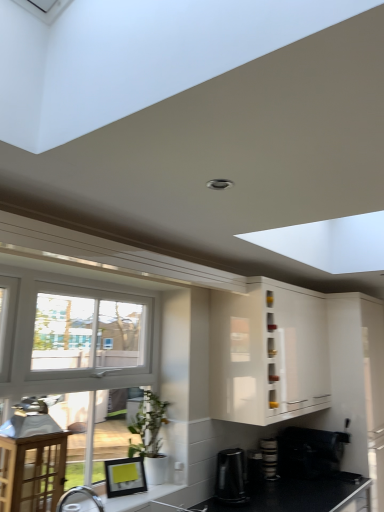
Looking at this image, what is the approximate height of black matte countertop at lower right?

11.59 inches.

This screenshot has height=512, width=384. Describe the element at coordinates (230, 477) in the screenshot. I see `black plastic coffee maker at lower center, which is the 1th appliance from left to right` at that location.

This screenshot has height=512, width=384. Identify the location of black plastic coffee maker at lower center, which is the 1th appliance from left to right. (230, 477).

Locate an element on the screen. The image size is (384, 512). stacked plates at lower right, which is the 3th appliance from left to right is located at coordinates (269, 457).

Where is `black matte coffee maker at lower right, the fourth appliance positioned from the left`? The image size is (384, 512). black matte coffee maker at lower right, the fourth appliance positioned from the left is located at coordinates (310, 452).

I want to click on black plastic coffee maker at lower center, the 2th appliance positioned from the left, so click(254, 466).

Considering the relative sizes of wooden table at left and white glossy countertop at lower left in the image provided, is wooden table at left thinner than white glossy countertop at lower left?

Indeed, wooden table at left has a lesser width compared to white glossy countertop at lower left.

Between point (17, 450) and point (169, 499), which one is positioned behind?

Point (169, 499)

In the scene shown: Which is more to the right, wooden table at left or white glossy countertop at lower left?

From the viewer's perspective, white glossy countertop at lower left appears more on the right side.

From their relative heights in the image, would you say wooden table at left is taller or shorter than white glossy countertop at lower left?

wooden table at left is taller than white glossy countertop at lower left.

Which of these two, white glossy countertop at lower left or stacked plates at lower right, which appears as the 2th appliance when viewed from the right, stands shorter?

white glossy countertop at lower left.

Is white glossy countertop at lower left wider or thinner than stacked plates at lower right, which appears as the 2th appliance when viewed from the right?

In the image, white glossy countertop at lower left appears to be wider than stacked plates at lower right, which appears as the 2th appliance when viewed from the right.

Between white glossy countertop at lower left and stacked plates at lower right, which is the 3th appliance from left to right, which one appears on the left side from the viewer's perspective?

Positioned to the left is white glossy countertop at lower left.

Does white glossy countertop at lower left touch stacked plates at lower right, which is the 3th appliance from left to right?

No, white glossy countertop at lower left is not beside stacked plates at lower right, which is the 3th appliance from left to right.

From the image's perspective, is white matte pot at lower center positioned above or below black matte countertop at lower right?

Clearly, from the image's perspective, white matte pot at lower center is above black matte countertop at lower right.

You are a GUI agent. You are given a task and a screenshot of the screen. Output one action in this format:
    pyautogui.click(x=<x>, y=<y>)
    Task: Click on the houseplant lying on the left of black matte countertop at lower right
    This screenshot has width=384, height=512.
    Given the screenshot: What is the action you would take?
    pyautogui.click(x=150, y=436)

In the scene shown: Is white matte pot at lower center facing towards black matte countertop at lower right?

No, white matte pot at lower center is not turned towards black matte countertop at lower right.

Considering the positions of objects white matte pot at lower center and black matte countertop at lower right in the image provided, who is more to the left, white matte pot at lower center or black matte countertop at lower right?

Positioned to the left is white matte pot at lower center.

From a real-world perspective, which is physically above, black matte countertop at lower right or wooden table at left?

In real-world perspective, wooden table at left is above.

Considering the sizes of objects black matte countertop at lower right and wooden table at left in the image provided, who is smaller, black matte countertop at lower right or wooden table at left?

With smaller size is wooden table at left.

Does black matte countertop at lower right come behind wooden table at left?

Yes, the depth of black matte countertop at lower right is greater than that of wooden table at left.

From the image's perspective, is black matte countertop at lower right over wooden table at left?

No.

Considering the positions of objects black plastic coffee maker at lower center, the 2th appliance positioned from the left, and white matte pot at lower center in the image provided, who is behind, black plastic coffee maker at lower center, the 2th appliance positioned from the left, or white matte pot at lower center?

black plastic coffee maker at lower center, the 2th appliance positioned from the left, is behind.

Between black plastic coffee maker at lower center, acting as the 3th appliance starting from the right, and white matte pot at lower center, which one appears on the left side from the viewer's perspective?

Positioned to the left is white matte pot at lower center.

Which is nearer, (257,463) or (165,472)?

Point (257,463).

Considering the sizes of objects black plastic coffee maker at lower center, acting as the 3th appliance starting from the right, and white matte pot at lower center in the image provided, who is taller, black plastic coffee maker at lower center, acting as the 3th appliance starting from the right, or white matte pot at lower center?

With more height is white matte pot at lower center.

Are stacked plates at lower right, which is the 3th appliance from left to right, and black plastic coffee maker at lower center, acting as the 3th appliance starting from the right, far apart?

No, there isn't a large distance between stacked plates at lower right, which is the 3th appliance from left to right, and black plastic coffee maker at lower center, acting as the 3th appliance starting from the right.

Does stacked plates at lower right, which appears as the 2th appliance when viewed from the right, appear on the left side of black plastic coffee maker at lower center, acting as the 3th appliance starting from the right?

Incorrect, stacked plates at lower right, which appears as the 2th appliance when viewed from the right, is not on the left side of black plastic coffee maker at lower center, acting as the 3th appliance starting from the right.

Which object is wider, stacked plates at lower right, which appears as the 2th appliance when viewed from the right, or black plastic coffee maker at lower center, acting as the 3th appliance starting from the right?

black plastic coffee maker at lower center, acting as the 3th appliance starting from the right.

Identify the location of the 1st appliance counting from the left of the stacked plates at lower right, which appears as the 2th appliance when viewed from the right. This screenshot has height=512, width=384. (254, 466).

Would you say white glossy countertop at lower left is to the left or to the right of white matte pot at lower center in the picture?

white glossy countertop at lower left is positioned on white matte pot at lower center's left side.

At what (x,y) coordinates should I click in order to perform the action: click on houseplant located above the white glossy countertop at lower left (from the image's perspective). Please return your answer as a coordinate pair (x, y). The height and width of the screenshot is (512, 384). Looking at the image, I should click on (150, 436).

Considering the relative sizes of white glossy countertop at lower left and white matte pot at lower center in the image provided, is white glossy countertop at lower left shorter than white matte pot at lower center?

Yes, white glossy countertop at lower left is shorter than white matte pot at lower center.

This screenshot has width=384, height=512. Identify the location of table that is above the white glossy countertop at lower left (from a real-world perspective). (32, 472).

The width and height of the screenshot is (384, 512). Identify the location of the 4th appliance behind the white glossy countertop at lower left, starting your count from the anchor. (269, 457).

Which object lies further to the anchor point wooden table at left, stacked plates at lower right, which is the 3th appliance from left to right, or white glossy cabinet at upper center?

stacked plates at lower right, which is the 3th appliance from left to right, is further to wooden table at left.

Looking at the image, which one is located further to black plastic coffee maker at lower center, the 2th appliance positioned from the left, black plastic coffee maker at lower center, which is the 1th appliance from left to right, or stacked plates at lower right, which appears as the 2th appliance when viewed from the right?

black plastic coffee maker at lower center, which is the 1th appliance from left to right, lies further to black plastic coffee maker at lower center, the 2th appliance positioned from the left, than the other object.

Estimate the real-world distances between objects in this image. Which object is further from white glossy cabinet at upper center, black matte coffee maker at lower right, arranged as the 1th appliance when viewed from the right, or black matte countertop at lower right?

black matte countertop at lower right.

Which object lies further to the anchor point white glossy cabinet at upper center, black matte coffee maker at lower right, arranged as the 1th appliance when viewed from the right, or black plastic coffee maker at lower center, acting as the 4th appliance starting from the right?

The object further to white glossy cabinet at upper center is black matte coffee maker at lower right, arranged as the 1th appliance when viewed from the right.

Based on their spatial positions, is white glossy cabinet at upper center or black plastic coffee maker at lower center, acting as the 4th appliance starting from the right, closer to white matte pot at lower center?

black plastic coffee maker at lower center, acting as the 4th appliance starting from the right.

In the scene shown: Considering their positions, is black plastic coffee maker at lower center, which is the 1th appliance from left to right, positioned closer to stacked plates at lower right, which appears as the 2th appliance when viewed from the right, than white glossy countertop at lower left?

black plastic coffee maker at lower center, which is the 1th appliance from left to right.

Looking at this image, based on their spatial positions, is black matte countertop at lower right or black plastic coffee maker at lower center, the 2th appliance positioned from the left, further from white glossy countertop at lower left?

The object further to white glossy countertop at lower left is black plastic coffee maker at lower center, the 2th appliance positioned from the left.

Considering their positions, is stacked plates at lower right, which appears as the 2th appliance when viewed from the right, positioned closer to black matte coffee maker at lower right, the fourth appliance positioned from the left, than black plastic coffee maker at lower center, the 2th appliance positioned from the left?

Based on the image, stacked plates at lower right, which appears as the 2th appliance when viewed from the right, appears to be nearer to black matte coffee maker at lower right, the fourth appliance positioned from the left.

Identify the location of houseplant between white glossy countertop at lower left and black matte countertop at lower right in the horizontal direction. (150, 436).

Find the location of a particular element. houseplant between wooden table at left and black plastic coffee maker at lower center, acting as the 4th appliance starting from the right, from left to right is located at coordinates (150, 436).

Find the location of a particular element. cabinetry located between white glossy countertop at lower left and black matte countertop at lower right in the left-right direction is located at coordinates click(x=268, y=354).

This screenshot has width=384, height=512. What are the coordinates of `countertop located between black plastic coffee maker at lower center, acting as the 3th appliance starting from the right, and black matte coffee maker at lower right, arranged as the 1th appliance when viewed from the right, in the left-right direction` in the screenshot? It's located at (300, 496).